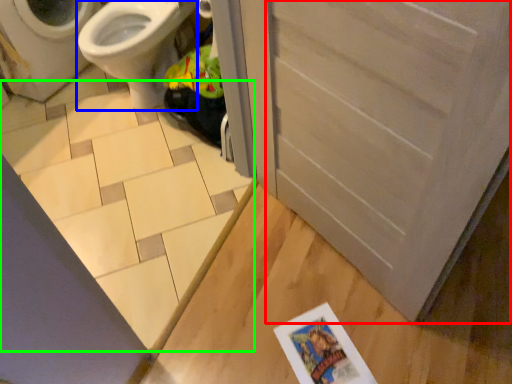
Question: Which object is positioned closest to screen door (highlighted by a red box)? Select from bidet (highlighted by a blue box) and tile (highlighted by a green box).

Choices:
 (A) bidet
 (B) tile

Answer: (B)